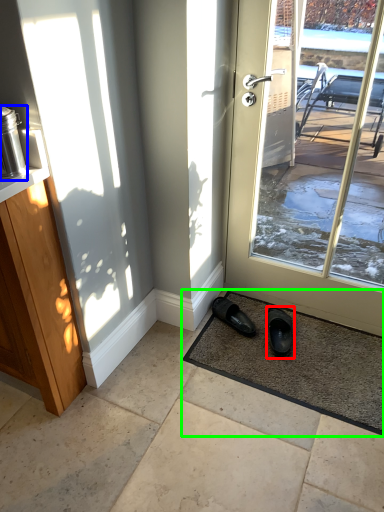
Question: Based on their relative distances, which object is nearer to footwear (highlighted by a red box)? Choose from appliance (highlighted by a blue box) and mat (highlighted by a green box).

Choices:
 (A) appliance
 (B) mat

Answer: (B)